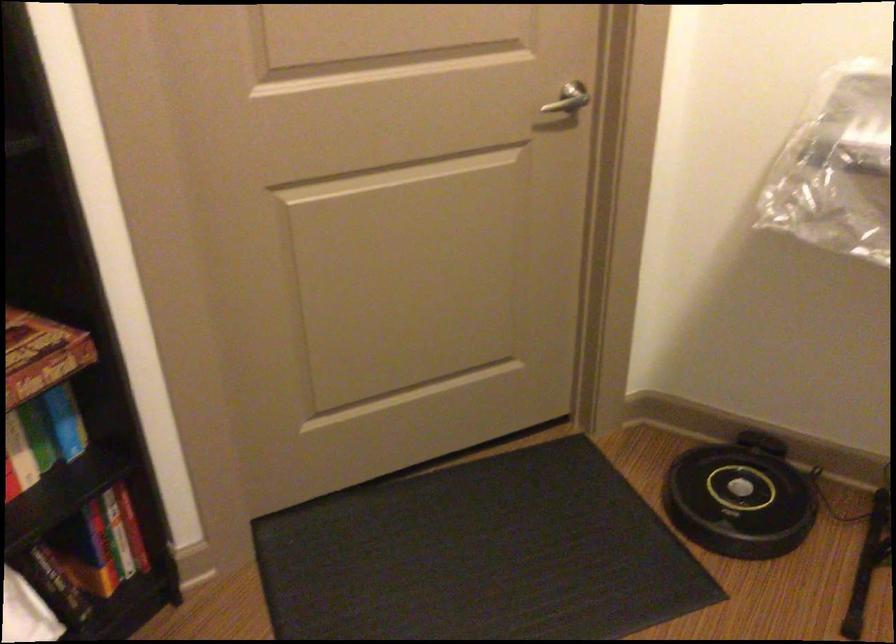
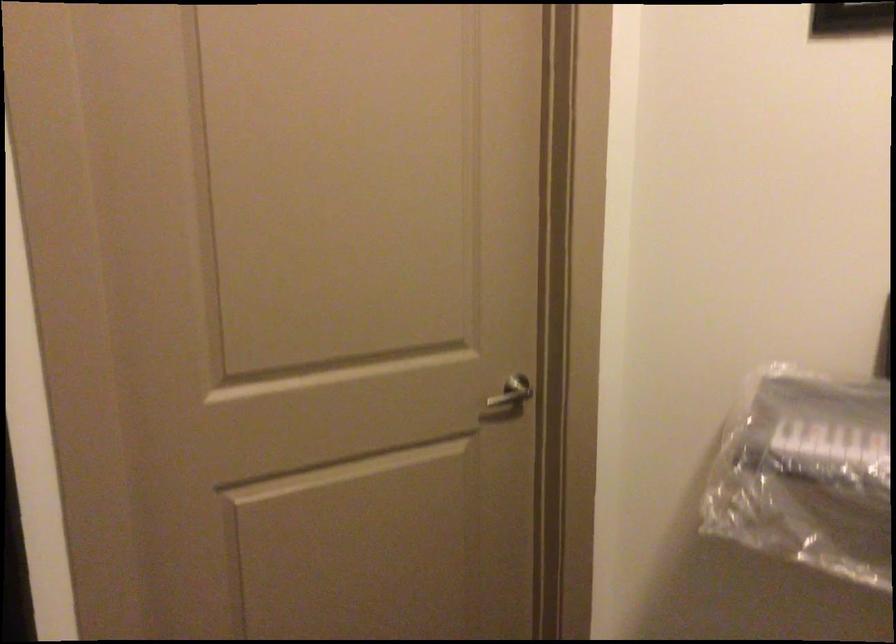
In the second image, find the point that corresponds to point (566, 98) in the first image.

(512, 392)